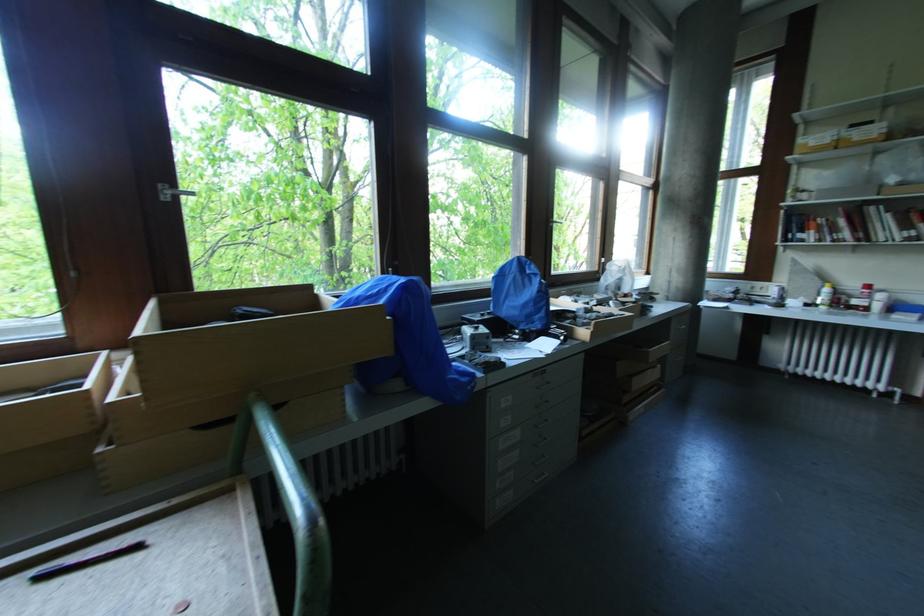
Image resolution: width=924 pixels, height=616 pixels. Identify the location of red bottle. (865, 296).